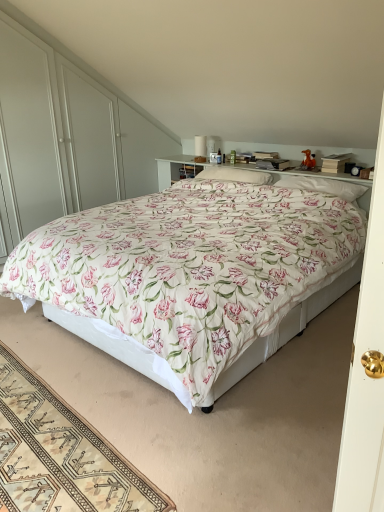
Question: Is floral fabric bed at center a part of white soft pillow at upper center, positioned as the 1th pillow in right-to-left order?

Choices:
 (A) no
 (B) yes

Answer: (A)

Question: Is white soft pillow at upper center, positioned as the 1th pillow in right-to-left order, thinner than floral fabric bed at center?

Choices:
 (A) yes
 (B) no

Answer: (A)

Question: From a real-world perspective, is white soft pillow at upper center, acting as the second pillow starting from the left, on floral fabric bed at center?

Choices:
 (A) yes
 (B) no

Answer: (A)

Question: Is white soft pillow at upper center, positioned as the 1th pillow in right-to-left order, at the left side of floral fabric bed at center?

Choices:
 (A) yes
 (B) no

Answer: (B)

Question: Considering the relative positions of white soft pillow at upper center, positioned as the 1th pillow in right-to-left order, and floral fabric bed at center in the image provided, is white soft pillow at upper center, positioned as the 1th pillow in right-to-left order, to the right of floral fabric bed at center from the viewer's perspective?

Choices:
 (A) yes
 (B) no

Answer: (A)

Question: From a real-world perspective, is beige woven rug at lower left physically located above or below white soft pillow at center, the first pillow from the left?

Choices:
 (A) below
 (B) above

Answer: (A)

Question: Is beige woven rug at lower left bigger or smaller than white soft pillow at center, which ranks as the 2th pillow in right-to-left order?

Choices:
 (A) small
 (B) big

Answer: (B)

Question: Is beige woven rug at lower left inside or outside of white soft pillow at center, the first pillow from the left?

Choices:
 (A) inside
 (B) outside

Answer: (B)

Question: Relative to white soft pillow at center, which ranks as the 2th pillow in right-to-left order, is beige woven rug at lower left in front or behind?

Choices:
 (A) behind
 (B) front

Answer: (B)

Question: Looking at their shapes, would you say white glossy dresser at upper center is wider or thinner than beige woven rug at lower left?

Choices:
 (A) thin
 (B) wide

Answer: (A)

Question: Does point (21, 92) appear closer or farther from the camera than point (9, 449)?

Choices:
 (A) closer
 (B) farther

Answer: (B)

Question: Based on their sizes in the image, would you say white glossy dresser at upper center is bigger or smaller than beige woven rug at lower left?

Choices:
 (A) small
 (B) big

Answer: (B)

Question: Is white glossy dresser at upper center in front of or behind beige woven rug at lower left in the image?

Choices:
 (A) behind
 (B) front

Answer: (A)

Question: Is white soft pillow at upper center, acting as the second pillow starting from the left, inside the boundaries of floral fabric bed at center, or outside?

Choices:
 (A) inside
 (B) outside

Answer: (A)

Question: Looking at their shapes, would you say white soft pillow at upper center, acting as the second pillow starting from the left, is wider or thinner than floral fabric bed at center?

Choices:
 (A) wide
 (B) thin

Answer: (B)